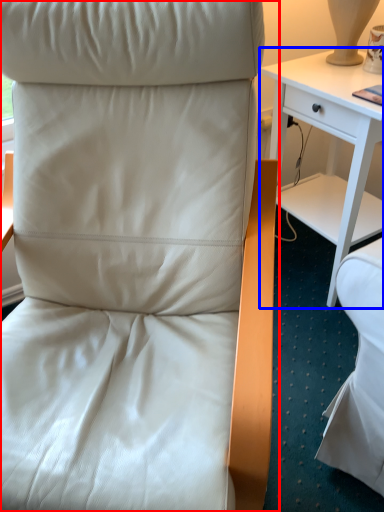
Question: Which point is closer to the camera, chair (highlighted by a red box) or desk (highlighted by a blue box)?

Choices:
 (A) chair
 (B) desk

Answer: (A)